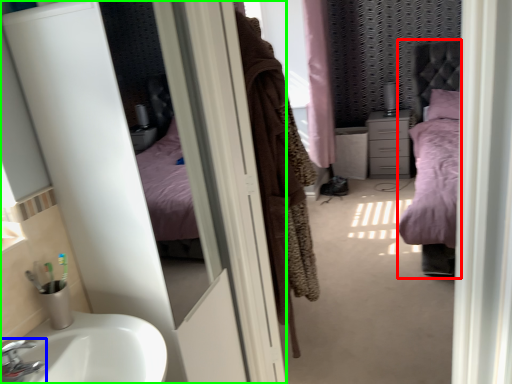
Question: Which object is positioned closest to bed (highlighted by a red box)? Select from tap (highlighted by a blue box) and screen door (highlighted by a green box).

Choices:
 (A) tap
 (B) screen door

Answer: (B)